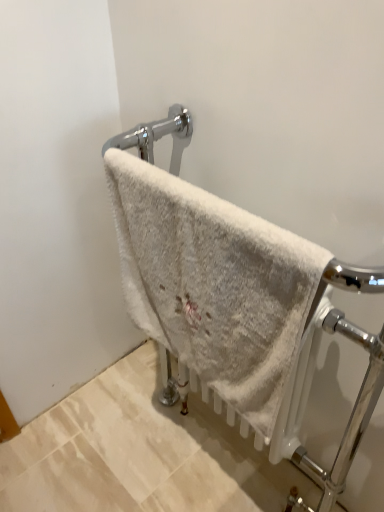
Describe the element at coordinates (213, 284) in the screenshot. The image size is (384, 512). I see `white textured towel at center` at that location.

Locate an element on the screen. This screenshot has height=512, width=384. white textured towel at center is located at coordinates (213, 284).

This screenshot has width=384, height=512. Find the location of `white textured towel at center`. white textured towel at center is located at coordinates (213, 284).